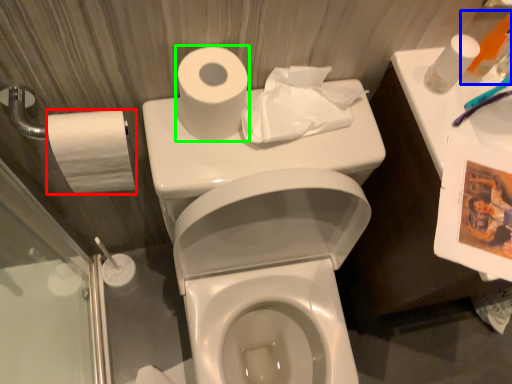
Question: Considering the real-world distances, which object is farthest from toilet paper (highlighted by a red box)? toiletry (highlighted by a blue box) or toilet paper (highlighted by a green box)?

Choices:
 (A) toiletry
 (B) toilet paper

Answer: (A)